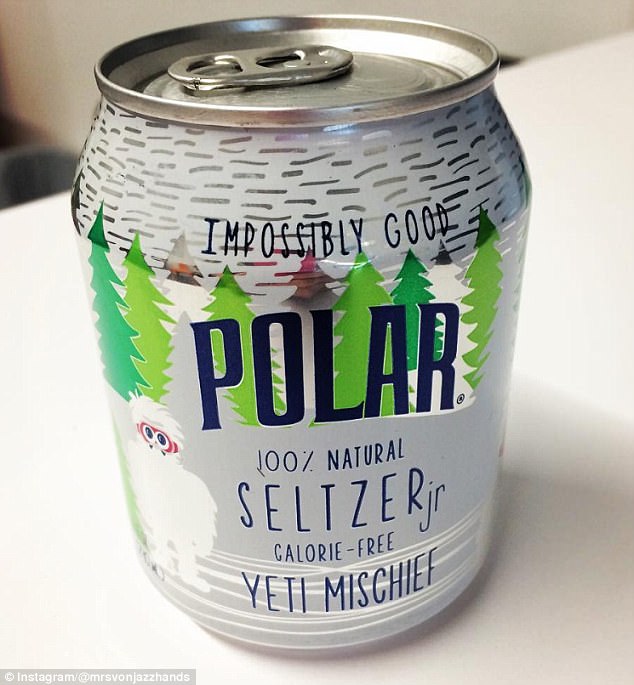
Locate an element on the screen. This screenshot has width=634, height=685. floor is located at coordinates (89, 560).